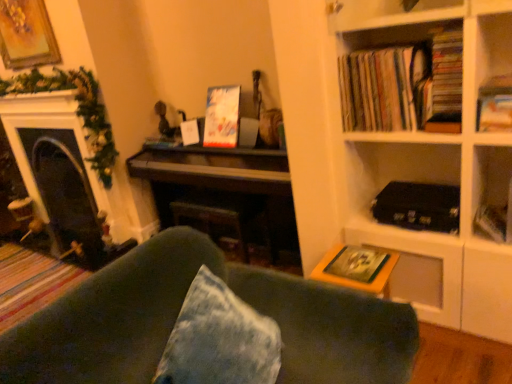
Question: Considering the relative positions of hardcover book at upper right, which is counted as the 1th paperback book, starting from the right, and yellow matte paperback book at lower right, positioned as the 3th paperback book in top-to-bottom order, in the image provided, is hardcover book at upper right, which is counted as the 1th paperback book, starting from the right, to the left or to the right of yellow matte paperback book at lower right, positioned as the 3th paperback book in top-to-bottom order,?

Choices:
 (A) left
 (B) right

Answer: (B)

Question: Considering the positions of point (497, 238) and point (373, 253), is point (497, 238) closer or farther from the camera than point (373, 253)?

Choices:
 (A) closer
 (B) farther

Answer: (B)

Question: Which object is the farthest from the dark wood piano at center?

Choices:
 (A) matte cardboard books at upper right, which appears as the second book when viewed from the right
 (B) matte black fireplace at left
 (C) hardcover book at upper right, the 2th paperback book viewed from the top
 (D) wooden bookcase at right
 (E) gold-framed painting at upper left

Answer: (E)

Question: Estimate the real-world distances between objects in this image. Which object is closer to the yellow matte paperback book at lower right, marked as the 2th paperback book in a left-to-right arrangement?

Choices:
 (A) green fabric couch at lower center
 (B) dark wood piano at center
 (C) hardcover book at upper right, arranged as the 2th book when viewed from the left
 (D) matte black fireplace at left
 (E) hardcover book at upper right, which is counted as the 1th paperback book, starting from the right

Answer: (A)